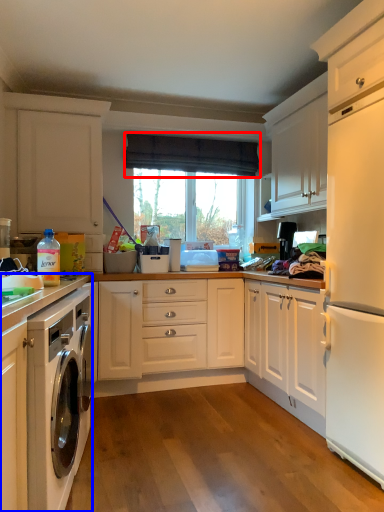
Question: Among these objects, which one is farthest to the camera, curtain (highlighted by a red box) or cabinetry (highlighted by a blue box)?

Choices:
 (A) curtain
 (B) cabinetry

Answer: (A)